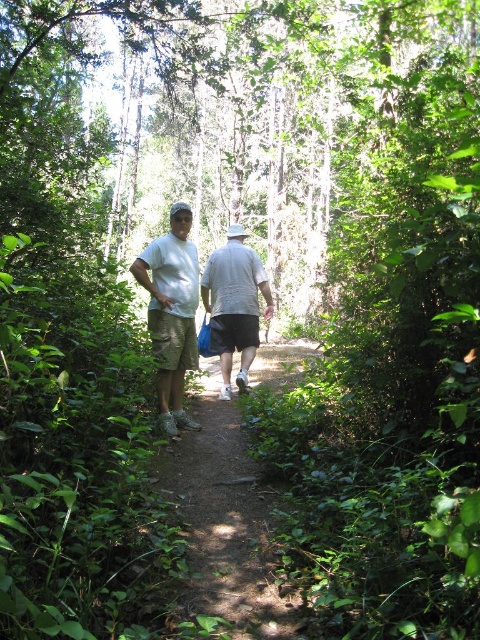
Question: Can you confirm if dirt path at center is wider than gray cotton shirt at center?

Choices:
 (A) no
 (B) yes

Answer: (A)

Question: Can you confirm if light gray cotton shirt at center is thinner than gray cotton shirt at center?

Choices:
 (A) no
 (B) yes

Answer: (B)

Question: Which object is the closest to the gray cotton shirt at center?

Choices:
 (A) light gray cotton shirt at center
 (B) dirt path at center

Answer: (A)

Question: Among these points, which one is farthest from the camera?

Choices:
 (A) (200, 444)
 (B) (237, 326)

Answer: (B)

Question: Among these points, which one is nearest to the camera?

Choices:
 (A) (168, 240)
 (B) (204, 480)

Answer: (B)

Question: Is dirt path at center above light gray cotton shirt at center?

Choices:
 (A) yes
 (B) no

Answer: (B)